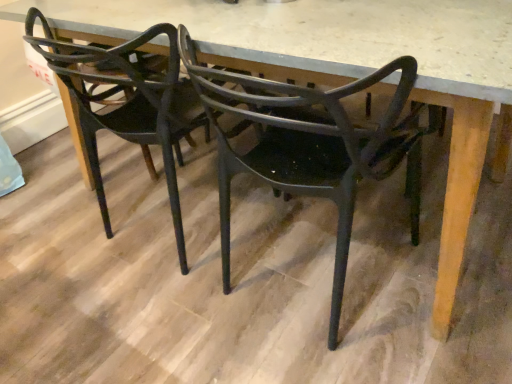
Identify the location of vacant space to the right of matte black chair at center, the 1th chair in the right-to-left sequence. (436, 270).